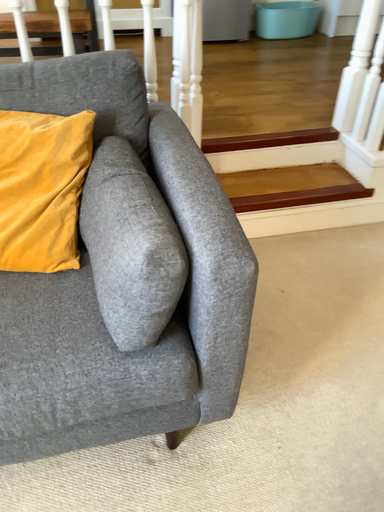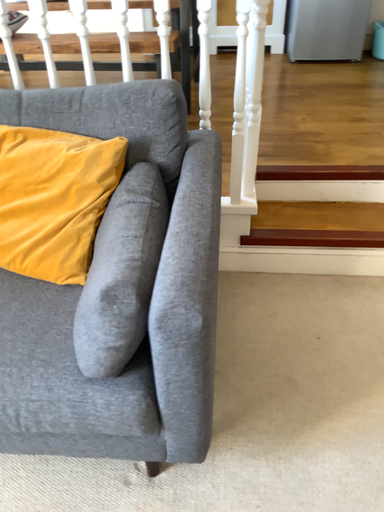
Question: Which way did the camera rotate in the video?

Choices:
 (A) rotated right
 (B) rotated left

Answer: (B)